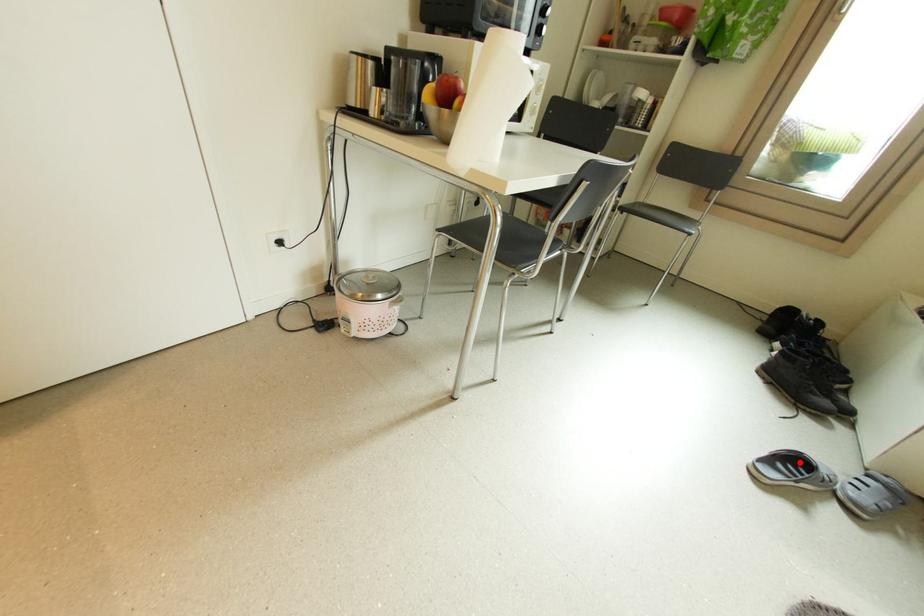
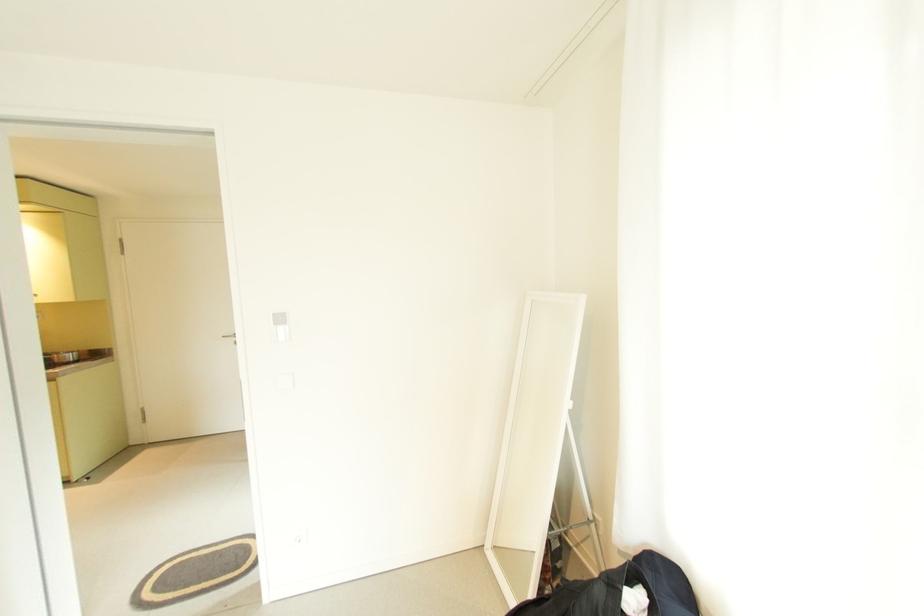
Question: I am providing you with two images of the same scene from different viewpoints. A red point is marked on the first image. Is the red point's position out of view in image 2?

Choices:
 (A) Yes
 (B) No

Answer: (A)